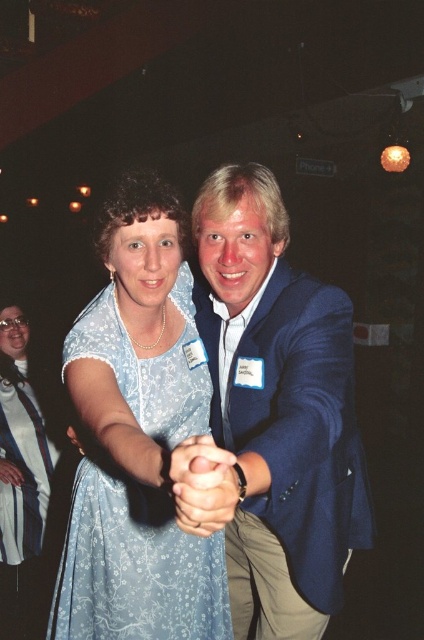
You are at a party and see two people in dresses. One is wearing a light blue floral dress at center and the other a light blue lace dress at center. Which one is on the right side?

The light blue floral dress at center is positioned on the right side of the light blue lace dress at center.

You are a photographer at the event and want to capture a photo where both the blue fabric suit at center and the light blue floral dress at center are clearly visible. Based on their positions, which one should you focus on first to ensure both are in focus?

The blue fabric suit at center is in front of the light blue floral dress at center. To ensure both are in focus, you should focus on the blue fabric suit at center first, as it is closer, and the depth of field will likely include the background subject as well.

You are standing in the middle of the event hall and see the light blue floral dress at center and the smooth skin hand at center. Which object is closer to you?

The light blue floral dress at center is closer to you than the smooth skin hand at center.